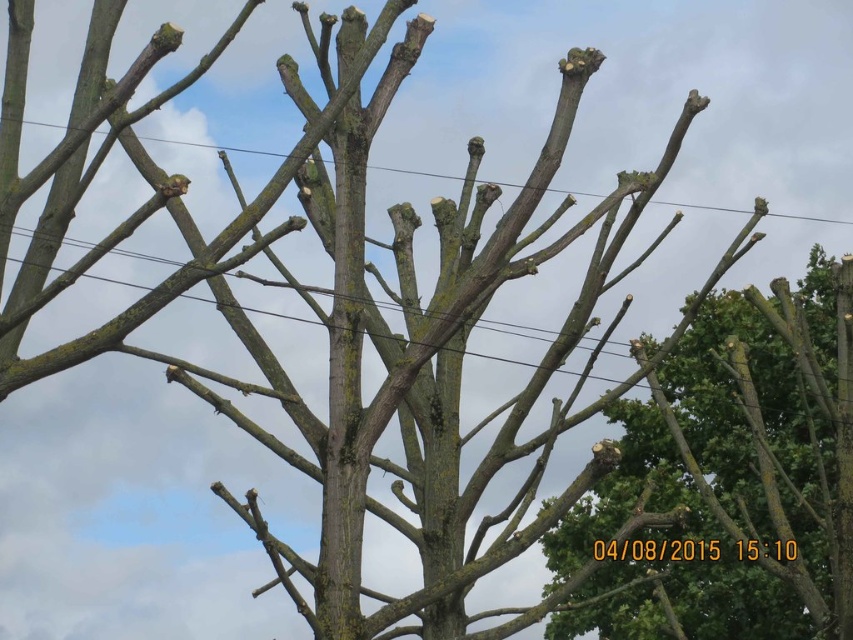
Can you confirm if brown wood power line at upper center is shorter than brown rough wood at center?

Correct, brown wood power line at upper center is not as tall as brown rough wood at center.

Describe the element at coordinates (212, 147) in the screenshot. I see `brown wood power line at upper center` at that location.

The height and width of the screenshot is (640, 853). What do you see at coordinates (212, 147) in the screenshot? I see `brown wood power line at upper center` at bounding box center [212, 147].

This screenshot has height=640, width=853. What are the coordinates of `brown wood power line at upper center` in the screenshot? It's located at (212, 147).

Does brown rough bark at right come in front of brown rough wood at center?

No.

Who is higher up, brown rough bark at right or brown rough wood at center?

brown rough wood at center is above.

Is point (821, 310) farther from camera compared to point (119, 348)?

That is True.

I want to click on brown rough bark at right, so click(x=746, y=461).

Does brown rough bark at right have a greater width compared to brown wood power line at upper center?

Incorrect, brown rough bark at right's width does not surpass brown wood power line at upper center's.

Between brown rough bark at right and brown wood power line at upper center, which one has less height?

With less height is brown wood power line at upper center.

Which is in front, point (831, 392) or point (695, 204)?

Point (831, 392) is in front.

Find the location of a particular element. This screenshot has height=640, width=853. brown rough bark at right is located at coordinates (746, 461).